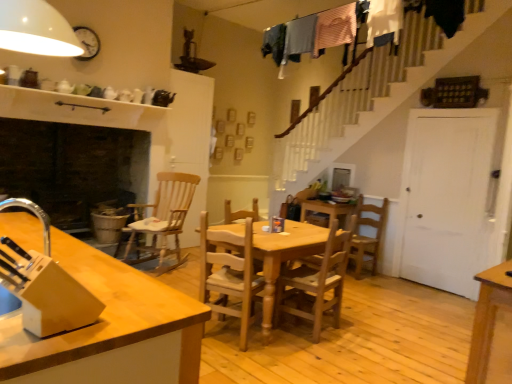
Locate an element on the screen. The height and width of the screenshot is (384, 512). vacant region in front of wooden table at center is located at coordinates (296, 363).